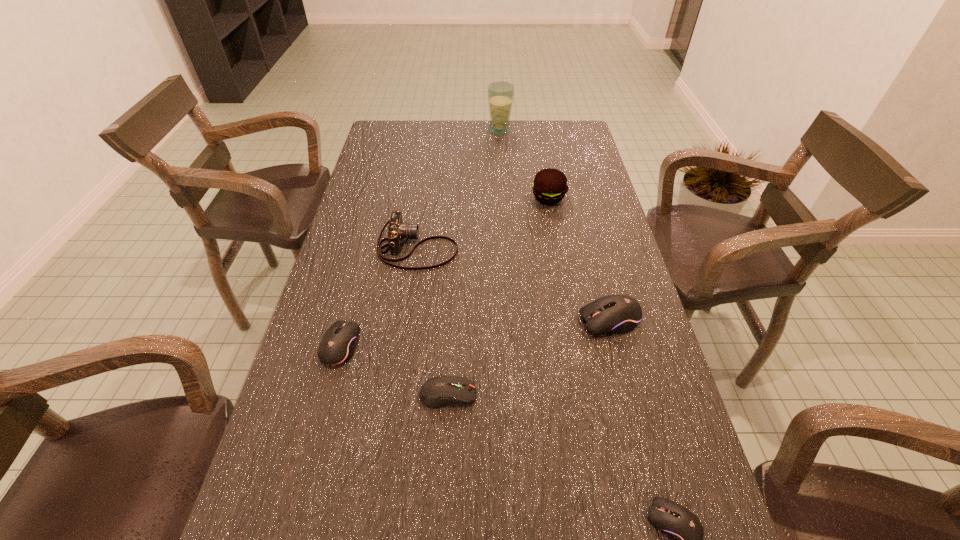
The image size is (960, 540). What are the coordinates of `the farthest object` in the screenshot? It's located at [500, 94].

I want to click on glass, so click(x=500, y=94).

Locate an element on the screen. Image resolution: width=960 pixels, height=540 pixels. patty is located at coordinates (549, 186).

Locate an element on the screen. The image size is (960, 540). the sixth nearest object is located at coordinates coord(549,186).

The image size is (960, 540). Identify the location of camera. (397, 231).

Where is `the third farthest object`? Image resolution: width=960 pixels, height=540 pixels. the third farthest object is located at coordinates (397, 231).

This screenshot has height=540, width=960. Find the location of `the tallest computer mouse`. the tallest computer mouse is located at coordinates (614, 313).

Locate an element on the screen. The image size is (960, 540). the leftmost black computer mouse is located at coordinates (338, 344).

Where is `the second tallest computer mouse`? The width and height of the screenshot is (960, 540). the second tallest computer mouse is located at coordinates (338, 344).

Where is `the sixth farthest object`? This screenshot has width=960, height=540. the sixth farthest object is located at coordinates (437, 392).